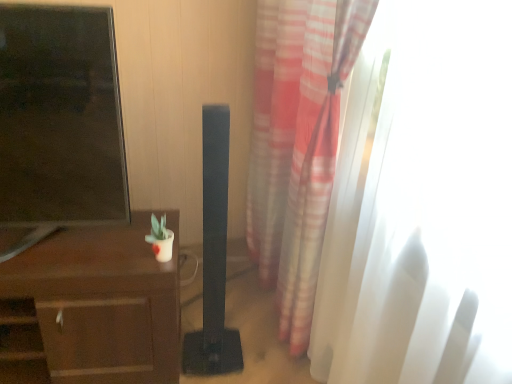
Question: Is brown wood desk at left looking in the opposite direction of translucent white curtain at right?

Choices:
 (A) no
 (B) yes

Answer: (A)

Question: From the image's perspective, is brown wood desk at left on top of translucent white curtain at right?

Choices:
 (A) no
 (B) yes

Answer: (A)

Question: From the image's perspective, would you say brown wood desk at left is shown under translucent white curtain at right?

Choices:
 (A) yes
 (B) no

Answer: (A)

Question: Are brown wood desk at left and translucent white curtain at right far apart?

Choices:
 (A) no
 (B) yes

Answer: (A)

Question: Considering the relative sizes of brown wood desk at left and translucent white curtain at right in the image provided, is brown wood desk at left shorter than translucent white curtain at right?

Choices:
 (A) no
 (B) yes

Answer: (B)

Question: From the image's perspective, is black matte speaker at center positioned above or below brown wood desk at left?

Choices:
 (A) below
 (B) above

Answer: (B)

Question: Would you say black matte speaker at center is to the left or to the right of brown wood desk at left in the picture?

Choices:
 (A) right
 (B) left

Answer: (A)

Question: Relative to brown wood desk at left, is black matte speaker at center in front or behind?

Choices:
 (A) front
 (B) behind

Answer: (A)

Question: Is black matte speaker at center bigger or smaller than brown wood desk at left?

Choices:
 (A) small
 (B) big

Answer: (A)

Question: In terms of height, does brown wood desk at left look taller or shorter compared to black matte speaker at center?

Choices:
 (A) short
 (B) tall

Answer: (A)

Question: Is point (36, 246) positioned closer to the camera than point (206, 150)?

Choices:
 (A) farther
 (B) closer

Answer: (A)

Question: Based on their sizes in the image, would you say brown wood desk at left is bigger or smaller than black matte speaker at center?

Choices:
 (A) small
 (B) big

Answer: (B)

Question: From a real-world perspective, is brown wood desk at left physically located above or below black matte speaker at center?

Choices:
 (A) above
 (B) below

Answer: (B)

Question: Is translucent white curtain at right wider or thinner than brown wood desk at left?

Choices:
 (A) thin
 (B) wide

Answer: (A)

Question: From a real-world perspective, is translucent white curtain at right physically located above or below brown wood desk at left?

Choices:
 (A) below
 (B) above

Answer: (B)